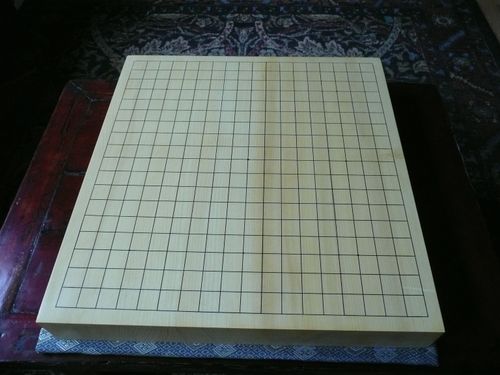
This screenshot has width=500, height=375. What are the coordinates of `middle of wooden grid` in the screenshot? It's located at (246, 172).